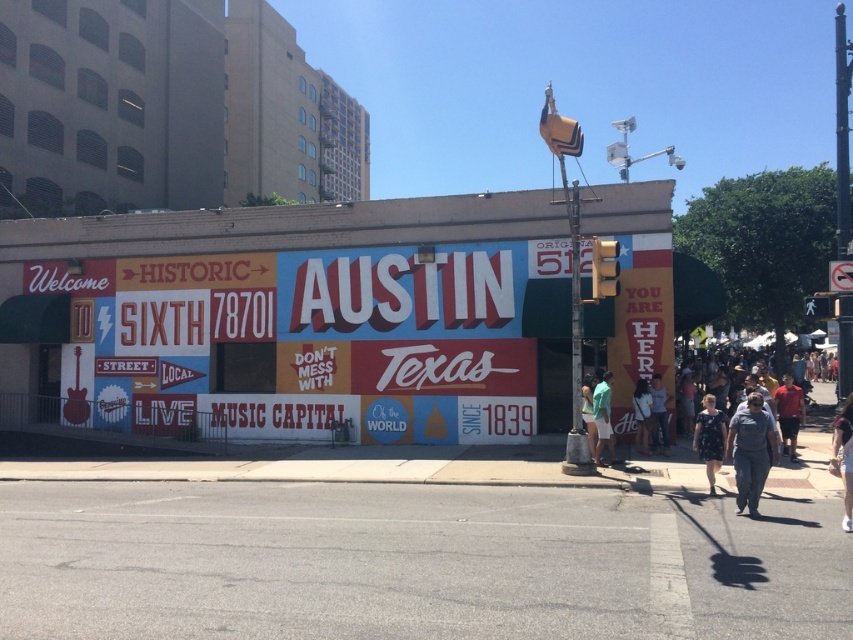
Does gray cotton shirt at center appear over green fabric shorts at lower right?

Indeed, gray cotton shirt at center is positioned over green fabric shorts at lower right.

Can you confirm if gray cotton shirt at center is bigger than green fabric shorts at lower right?

Yes.

Who is more forward, (751, 429) or (606, 420)?

Point (751, 429)

Where is `gray cotton shirt at center`? gray cotton shirt at center is located at coordinates (750, 451).

Does white cotton shirt at lower right lie in front of white fabric shirt at lower right?

No, white cotton shirt at lower right is behind white fabric shirt at lower right.

Which is behind, point (654, 376) or point (641, 451)?

Positioned behind is point (654, 376).

Find the location of a particular element. white cotton shirt at lower right is located at coordinates (659, 413).

Is dark blue denim shorts at lower right to the left of green fabric pants at lower right from the viewer's perspective?

In fact, dark blue denim shorts at lower right is to the right of green fabric pants at lower right.

Between point (848, 433) and point (590, 410), which one is positioned in front?

Positioned in front is point (848, 433).

Where is `dark blue denim shorts at lower right`? This screenshot has width=853, height=640. dark blue denim shorts at lower right is located at coordinates (843, 458).